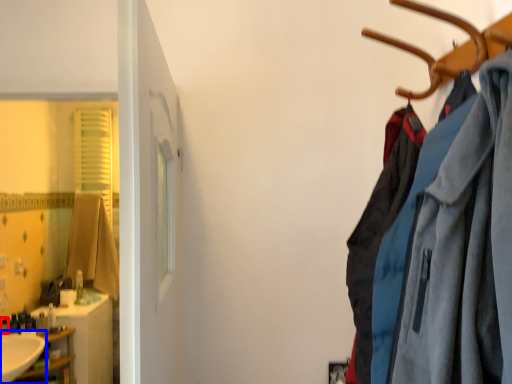
Question: Which object appears farthest to the camera in this image, toiletry (highlighted by a red box) or sink (highlighted by a blue box)?

Choices:
 (A) toiletry
 (B) sink

Answer: (A)